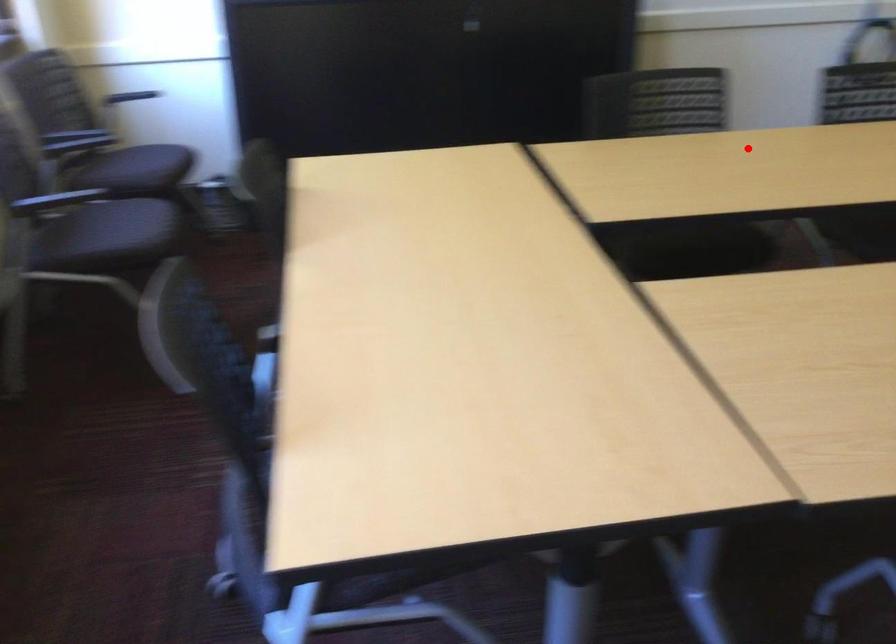
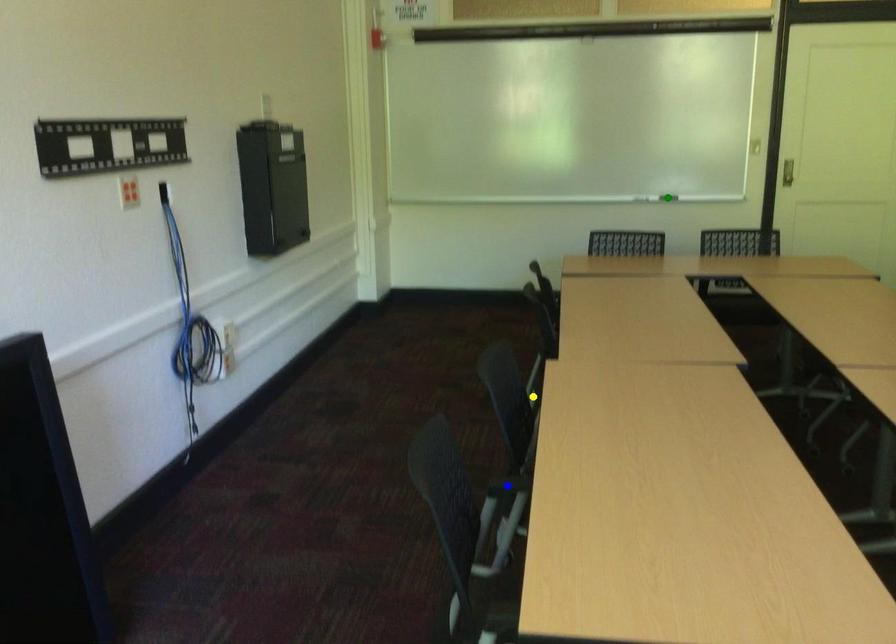
Question: I am providing you with two images of the same scene from different viewpoints. A red point is marked on the first image. You are given multiple points on the second image. Which point in image 2 is actually the same real-world point as the red point in image 1?

Choices:
 (A) yellow point
 (B) blue point
 (C) green point

Answer: (B)